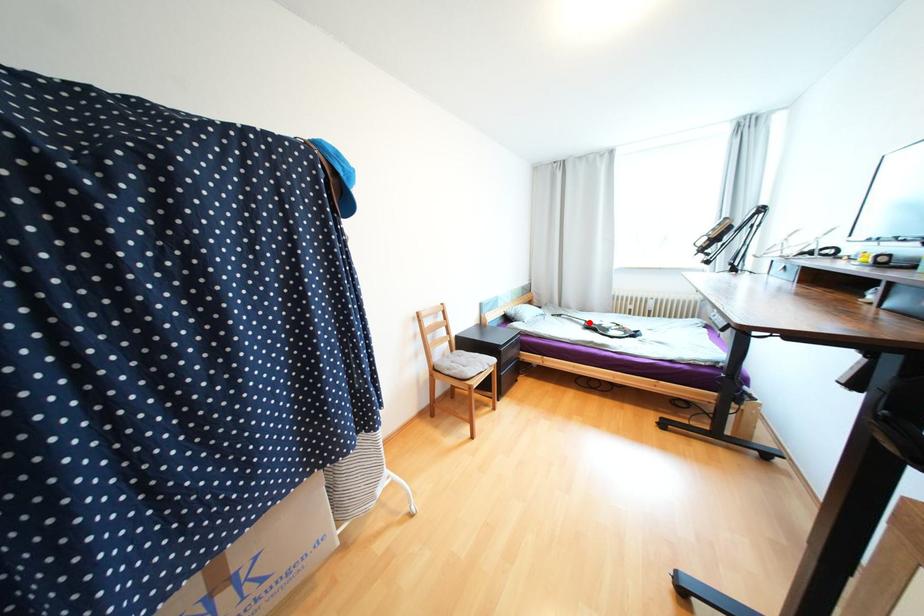
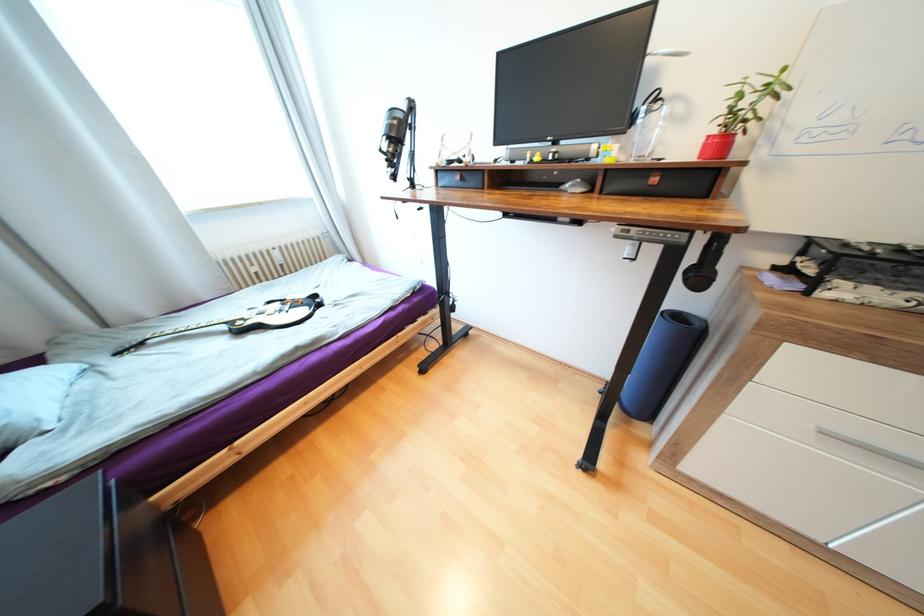
Find the pixel in the second image that matches the highlighted location in the first image.

(229, 328)